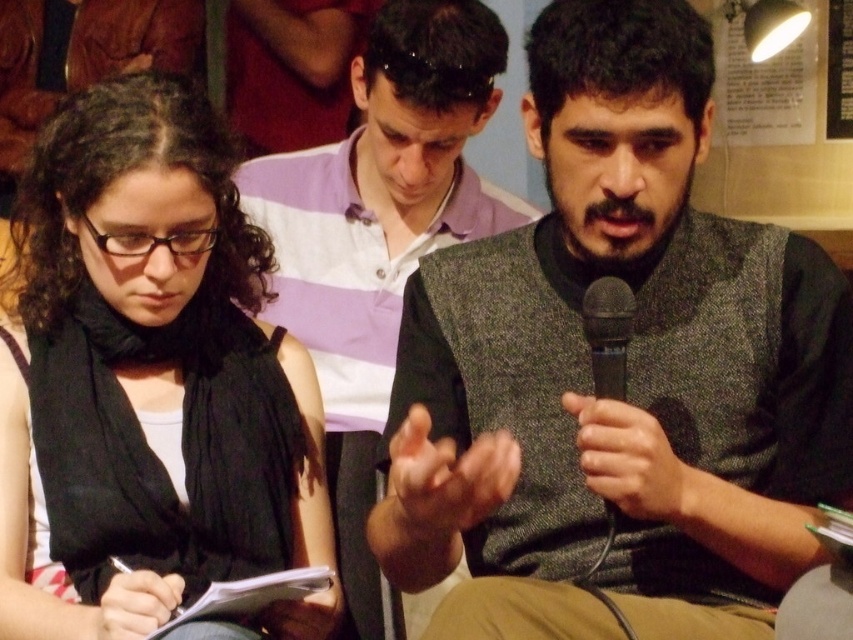
Between striped cotton shirt at center and black plastic microphone at right, which one has less height?

Standing shorter between the two is black plastic microphone at right.

Who is more distant from viewer, [438,115] or [595,378]?

The point [438,115] is behind.

Where is `striped cotton shirt at center`? The image size is (853, 640). striped cotton shirt at center is located at coordinates (378, 237).

You are a GUI agent. You are given a task and a screenshot of the screen. Output one action in this format:
    pyautogui.click(x=<x>, y=<y>)
    Task: Click on the black fabric at left
    This screenshot has width=853, height=640.
    Given the screenshot: What is the action you would take?
    (x=148, y=372)

Who is shorter, black fabric at left or striped cotton shirt at center?

Standing shorter between the two is black fabric at left.

At what (x,y) coordinates should I click in order to perform the action: click on black fabric at left. Please return your answer as a coordinate pair (x, y). Looking at the image, I should click on (148, 372).

You are a GUI agent. You are given a task and a screenshot of the screen. Output one action in this format:
    pyautogui.click(x=<x>, y=<y>)
    Task: Click on the black fabric at left
    
    Given the screenshot: What is the action you would take?
    pyautogui.click(x=148, y=372)

Is dark gray textured vest at center behind black fabric at left?

No, dark gray textured vest at center is in front of black fabric at left.

Which is above, dark gray textured vest at center or black fabric at left?

Positioned higher is dark gray textured vest at center.

Is point (590, 225) positioned in front of point (194, 364)?

Yes, point (590, 225) is closer to viewer.

Identify the location of dark gray textured vest at center. (630, 371).